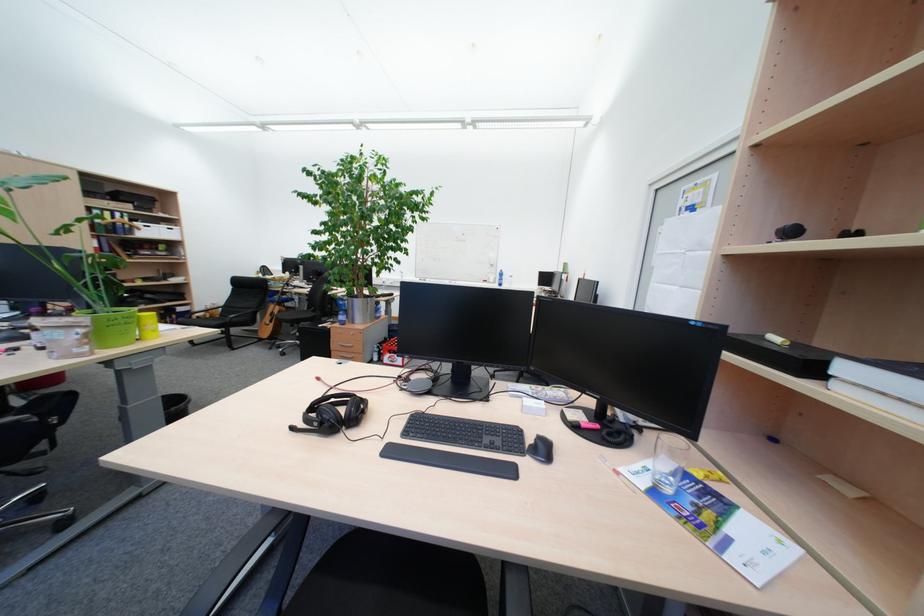
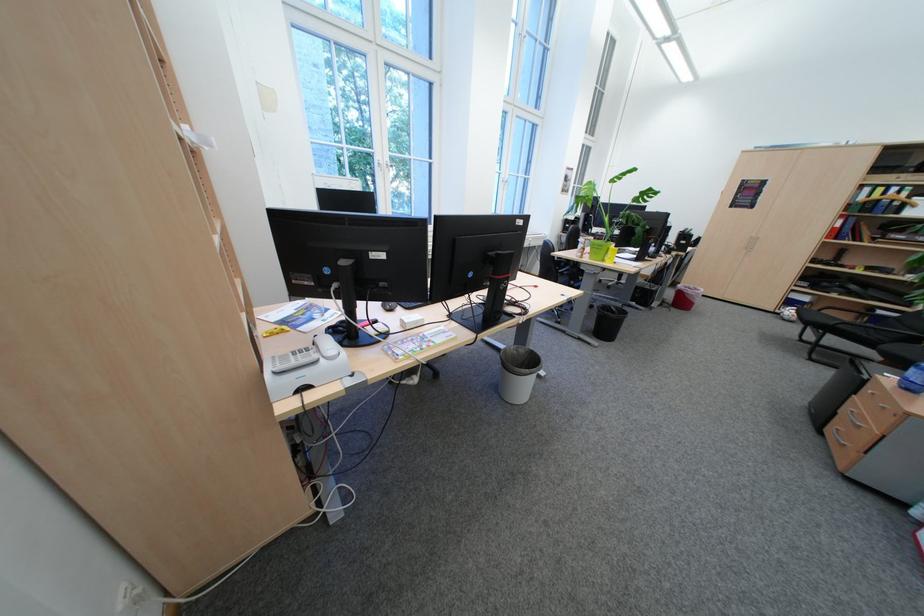
The point at (119, 214) is marked in the first image. Where is the corresponding point in the second image?

(893, 190)